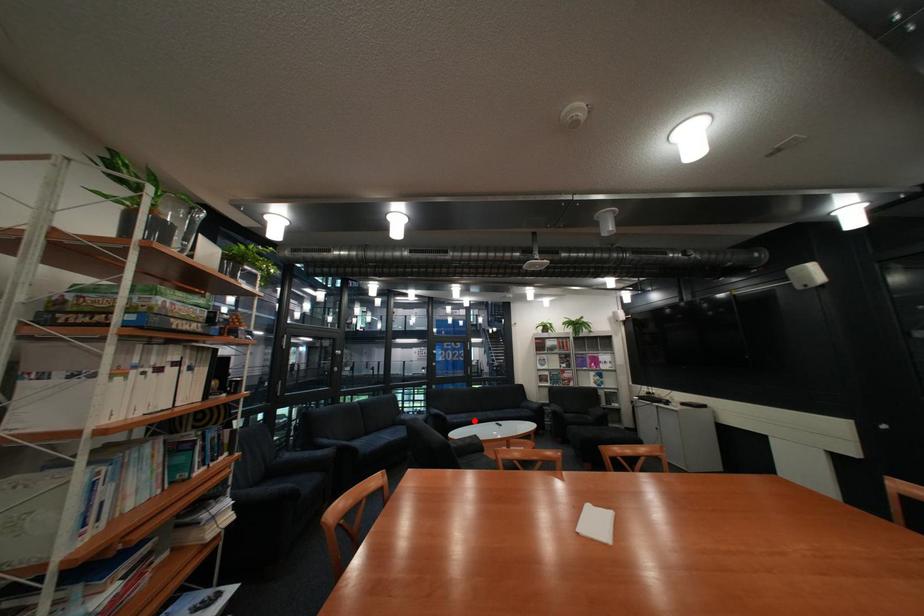
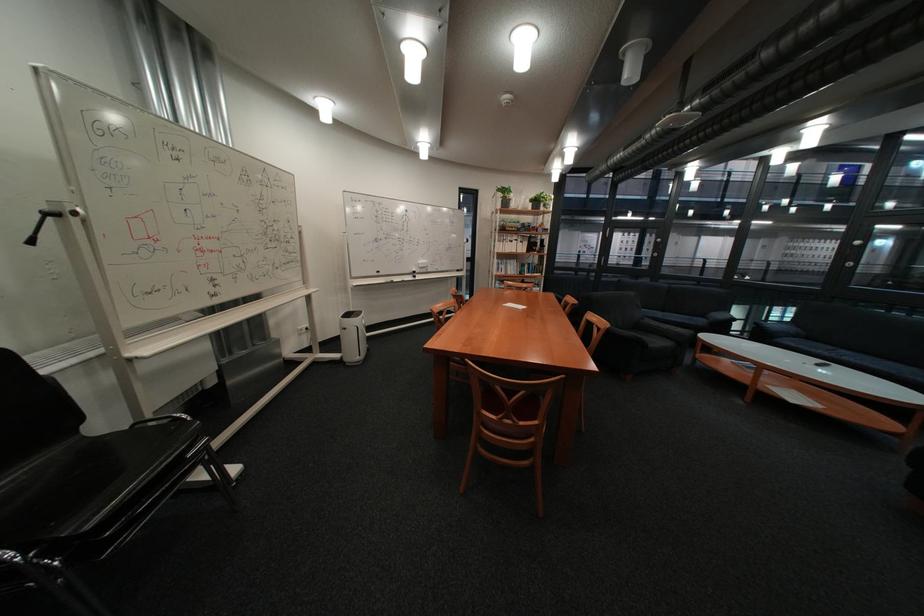
Where in the second image is the point corresponding to the highlighted location from the first image?

(808, 345)